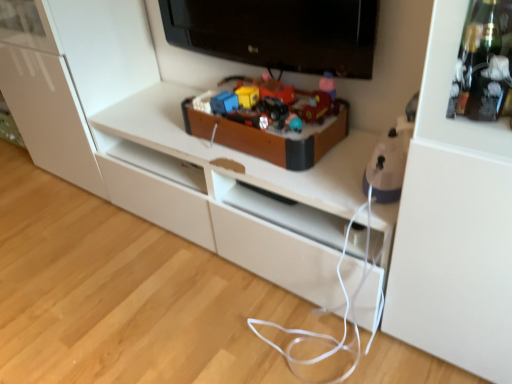
Question: Are black glossy television at upper center and wooden toy box at center, positioned as the 1th toy in back-to-front order, located far from each other?

Choices:
 (A) yes
 (B) no

Answer: (B)

Question: Is black glossy television at upper center turned away from wooden toy box at center, which appears as the 2th toy when viewed from the right?

Choices:
 (A) no
 (B) yes

Answer: (A)

Question: Can you confirm if black glossy television at upper center is taller than wooden toy box at center, which appears as the 2th toy when viewed from the right?

Choices:
 (A) no
 (B) yes

Answer: (B)

Question: Does black glossy television at upper center have a lesser height compared to wooden toy box at center, which is the second toy in front-to-back order?

Choices:
 (A) no
 (B) yes

Answer: (A)

Question: Does black glossy television at upper center have a larger size compared to wooden toy box at center, which appears as the 2th toy when viewed from the right?

Choices:
 (A) yes
 (B) no

Answer: (A)

Question: Considering the positions of purple plastic iron at right, positioned as the 1th toy in front-to-back order, and wooden toy box at center, positioned as the 1th toy in back-to-front order, in the image, is purple plastic iron at right, positioned as the 1th toy in front-to-back order, wider or thinner than wooden toy box at center, positioned as the 1th toy in back-to-front order,?

Choices:
 (A) wide
 (B) thin

Answer: (B)

Question: In terms of size, does purple plastic iron at right, which is the first toy from right to left, appear bigger or smaller than wooden toy box at center, the 1th toy positioned from the left?

Choices:
 (A) big
 (B) small

Answer: (B)

Question: Is point (372, 172) positioned closer to the camera than point (237, 114)?

Choices:
 (A) closer
 (B) farther

Answer: (A)

Question: From the image's perspective, is purple plastic iron at right, which is the 2th toy in back-to-front order, above or below wooden toy box at center, the 1th toy positioned from the left?

Choices:
 (A) below
 (B) above

Answer: (A)

Question: In the image, is wooden toy box at center, positioned as the 1th toy in back-to-front order, on the left side or the right side of black glossy television at upper center?

Choices:
 (A) right
 (B) left

Answer: (B)

Question: From their relative heights in the image, would you say wooden toy box at center, which appears as the 2th toy when viewed from the right, is taller or shorter than black glossy television at upper center?

Choices:
 (A) short
 (B) tall

Answer: (A)

Question: Does point (295, 158) appear closer or farther from the camera than point (286, 41)?

Choices:
 (A) farther
 (B) closer

Answer: (B)

Question: From the image's perspective, is wooden toy box at center, the 1th toy positioned from the left, located above or below black glossy television at upper center?

Choices:
 (A) above
 (B) below

Answer: (B)

Question: Does point (321, 87) appear closer or farther from the camera than point (367, 175)?

Choices:
 (A) closer
 (B) farther

Answer: (B)

Question: Would you say wooden toy box at center, positioned as the 1th toy in back-to-front order, is to the left or to the right of purple plastic iron at right, which is the 2th toy in back-to-front order, in the picture?

Choices:
 (A) left
 (B) right

Answer: (A)